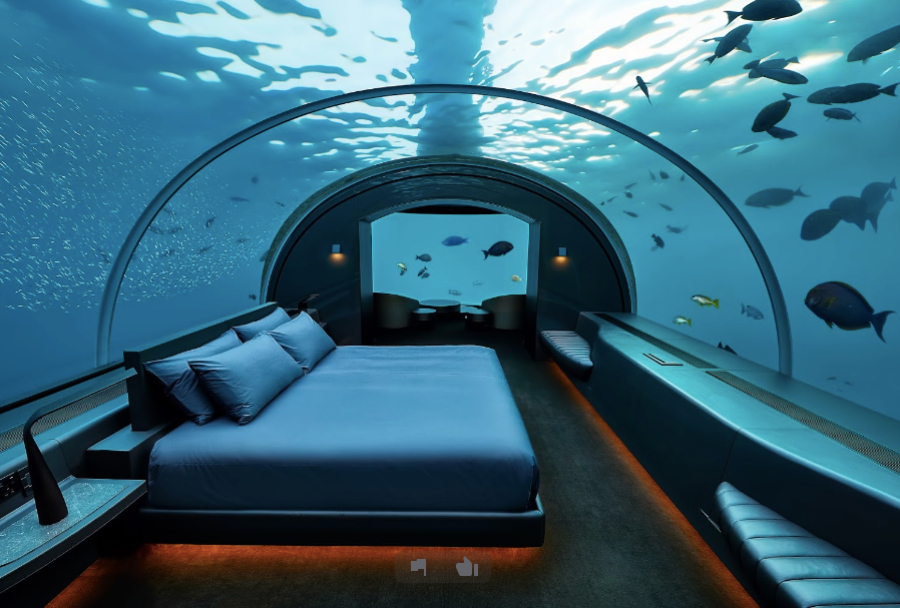
Where is `blanket`? blanket is located at coordinates (414, 425).